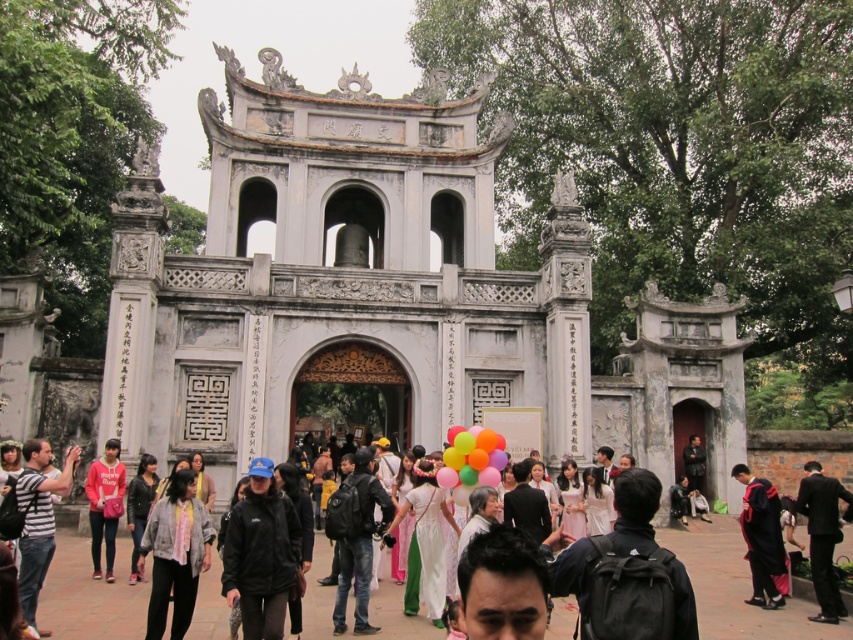
Question: Does dark blue leather jacket at center have a lesser width compared to pink satin dress at center?

Choices:
 (A) no
 (B) yes

Answer: (A)

Question: Which object is positioned farthest from the white satin dress at center?

Choices:
 (A) black suit at right
 (B) light brown leather jacket at center

Answer: (B)

Question: Which object appears closest to the camera in this image?

Choices:
 (A) dark gray jeans at center
 (B) light brown leather jacket at center
 (C) dark blue leather jacket at center
 (D) striped cotton shirt at lower left

Answer: (D)

Question: Which of these objects is positioned farthest from the striped cotton shirt at lower left?

Choices:
 (A) white satin dress at center
 (B) pink satin dress at center
 (C) black suit at right
 (D) matte pink hoodie at lower left

Answer: (C)

Question: Can you confirm if white silk dress at center is positioned to the left of black suit at right?

Choices:
 (A) yes
 (B) no

Answer: (A)

Question: Is black matte jacket at center below light brown leather jacket at center?

Choices:
 (A) yes
 (B) no

Answer: (B)